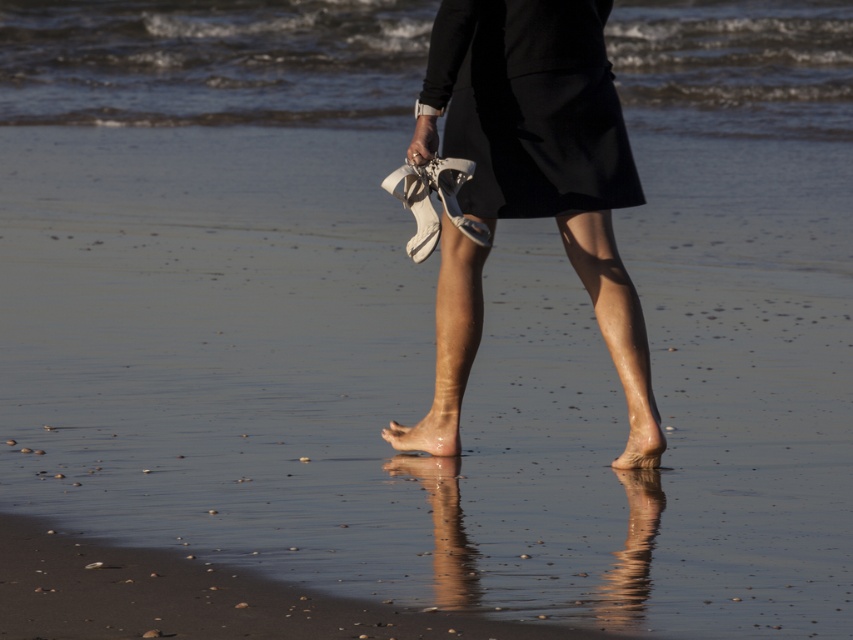
You are standing on the beach and see the clear water at center and the black matte dress at center. Which object is closer to your feet?

The clear water at center is located above the black matte dress at center, so the water is closer to your feet than the dress.

You are standing on the beach and want to wade into the water. Where exactly is the clear water at center located in the image?

The clear water at center is located at point (212, 61) in the image.

You are standing at the point where the person is currently standing. The clear water at center is located at point (212, 61). If you want to reach the clear water at center, which direction should you move in?

The clear water at center is located at point (212, 61), so you should move towards that coordinate to reach it.